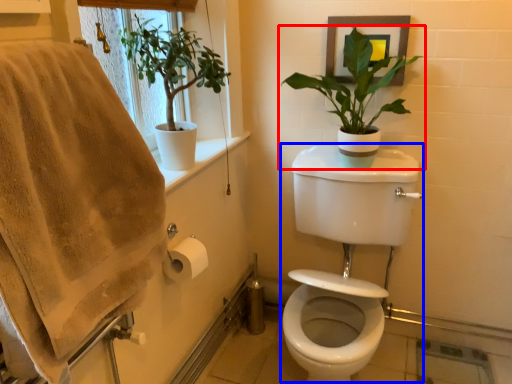
Question: Which of the following is the closest to the observer, houseplant (highlighted by a red box) or sink (highlighted by a blue box)?

Choices:
 (A) houseplant
 (B) sink

Answer: (B)